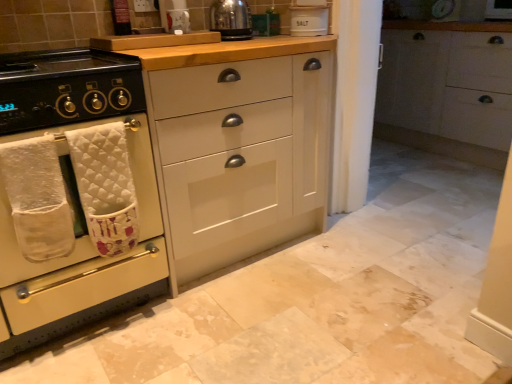
Question: Is white matte cabinet at right, which is counted as the 1th cabinetry, starting from the right, at the left side of white ceramic salt container at upper center?

Choices:
 (A) yes
 (B) no

Answer: (B)

Question: From a real-world perspective, is white matte cabinet at right, which is counted as the 1th cabinetry, starting from the right, located higher than white ceramic salt container at upper center?

Choices:
 (A) yes
 (B) no

Answer: (B)

Question: Is white matte cabinet at right, which is counted as the 1th cabinetry, starting from the right, thinner than white ceramic salt container at upper center?

Choices:
 (A) no
 (B) yes

Answer: (A)

Question: Does white matte cabinet at right, which is counted as the third cabinetry, starting from the left, have a greater height compared to white ceramic salt container at upper center?

Choices:
 (A) yes
 (B) no

Answer: (A)

Question: Is white matte cabinet at right, which is counted as the 1th cabinetry, starting from the right, positioned behind white ceramic salt container at upper center?

Choices:
 (A) no
 (B) yes

Answer: (B)

Question: From a real-world perspective, is white matte cabinet at right, which is counted as the third cabinetry, starting from the left, below white ceramic salt container at upper center?

Choices:
 (A) no
 (B) yes

Answer: (B)

Question: From the image's perspective, would you say white ceramic salt container at upper center is shown under shiny metallic kettle at upper center?

Choices:
 (A) no
 (B) yes

Answer: (A)

Question: Does white ceramic salt container at upper center have a greater height compared to shiny metallic kettle at upper center?

Choices:
 (A) no
 (B) yes

Answer: (B)

Question: Is white ceramic salt container at upper center directly adjacent to shiny metallic kettle at upper center?

Choices:
 (A) yes
 (B) no

Answer: (B)

Question: Is white ceramic salt container at upper center far away from shiny metallic kettle at upper center?

Choices:
 (A) no
 (B) yes

Answer: (A)

Question: Is white ceramic salt container at upper center bigger than shiny metallic kettle at upper center?

Choices:
 (A) yes
 (B) no

Answer: (B)

Question: Is white ceramic salt container at upper center oriented away from shiny metallic kettle at upper center?

Choices:
 (A) yes
 (B) no

Answer: (B)

Question: From a real-world perspective, is shiny metallic kettle at upper center over white quilted bath towel at left, positioned as the 2th bath towel in left-to-right order?

Choices:
 (A) no
 (B) yes

Answer: (B)